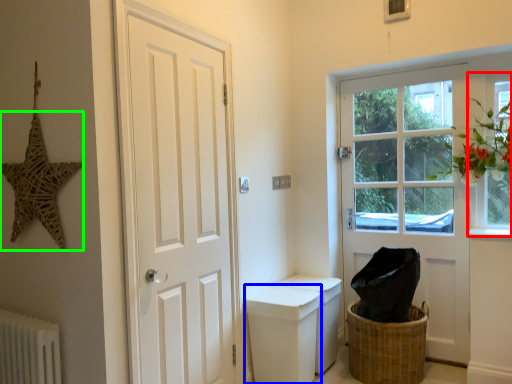
Question: Estimate the real-world distances between objects in this image. Which object is farther from window (highlighted by a red box), toilet bowl (highlighted by a blue box) or star (highlighted by a green box)?

Choices:
 (A) toilet bowl
 (B) star

Answer: (B)